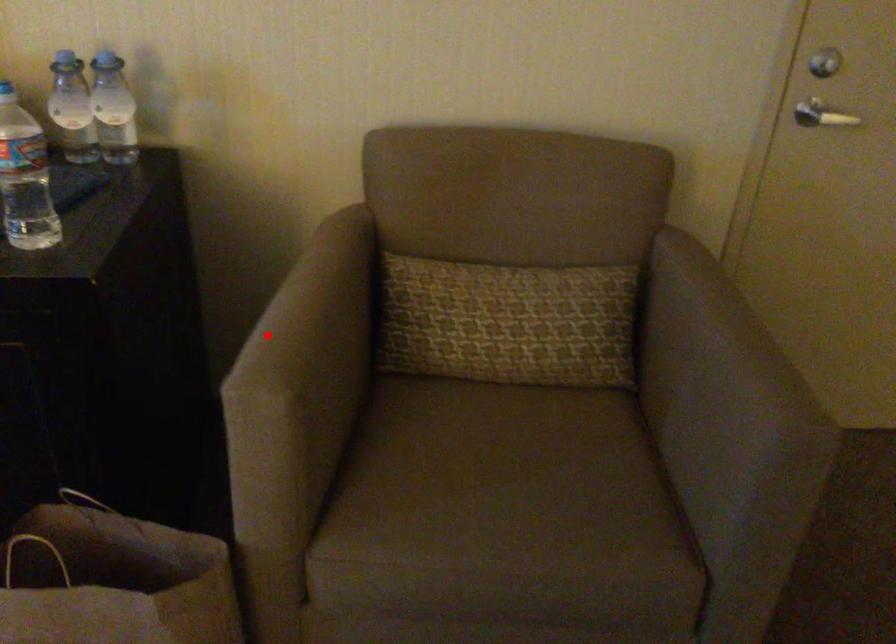
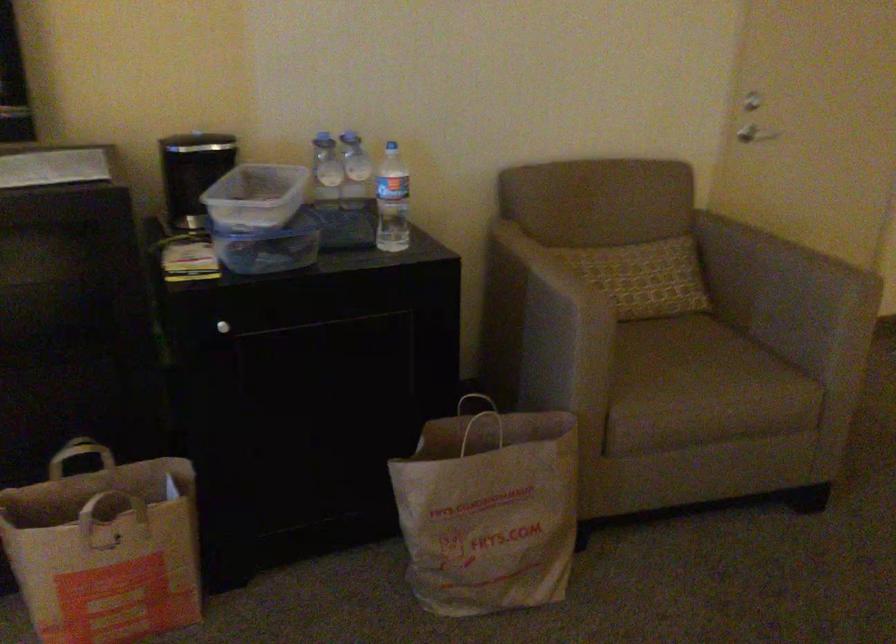
Question: I am providing you with two images of the same scene from different viewpoints. In image1, a red point is highlighted. Considering the same 3D point in image2, which of the following is correct?

Choices:
 (A) It is closer
 (B) It is farther

Answer: (B)